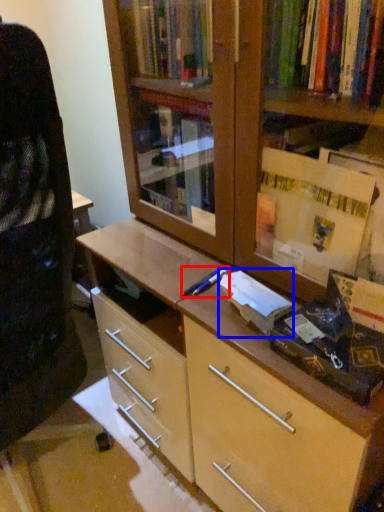
Question: Which of the following is the farthest to the observer, pen (highlighted by a red box) or book (highlighted by a blue box)?

Choices:
 (A) pen
 (B) book

Answer: (A)